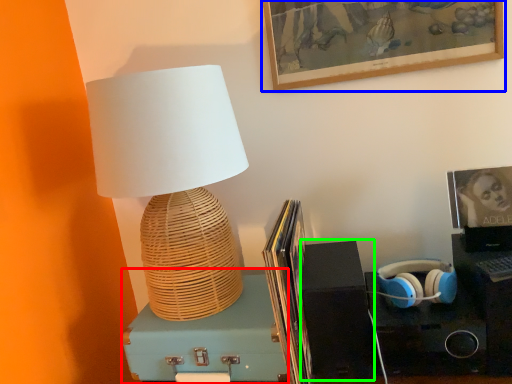
Question: Which object is positioned closest to box (highlighted by a red box)? Select from picture frame (highlighted by a blue box) and speaker (highlighted by a green box).

Choices:
 (A) picture frame
 (B) speaker

Answer: (B)